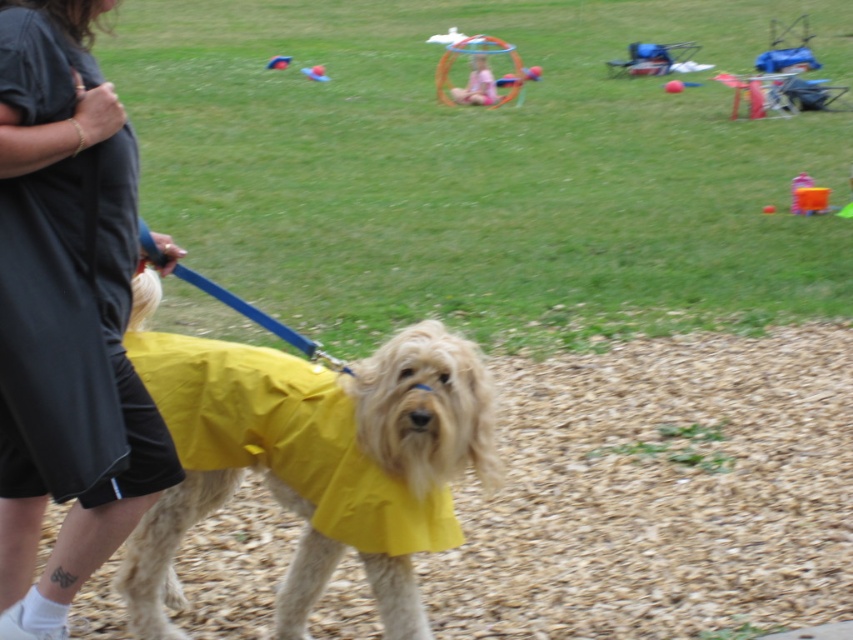
Question: Does black fabric dress at left appear on the left side of yellow fabric dog at center?

Choices:
 (A) no
 (B) yes

Answer: (B)

Question: Is black fabric dress at left smaller than yellow fabric dog at center?

Choices:
 (A) no
 (B) yes

Answer: (B)

Question: Which point is closer to the camera?

Choices:
 (A) black fabric dress at left
 (B) yellow fabric dog at center

Answer: (A)

Question: Does black fabric dress at left have a smaller size compared to yellow fabric dog at center?

Choices:
 (A) no
 (B) yes

Answer: (B)